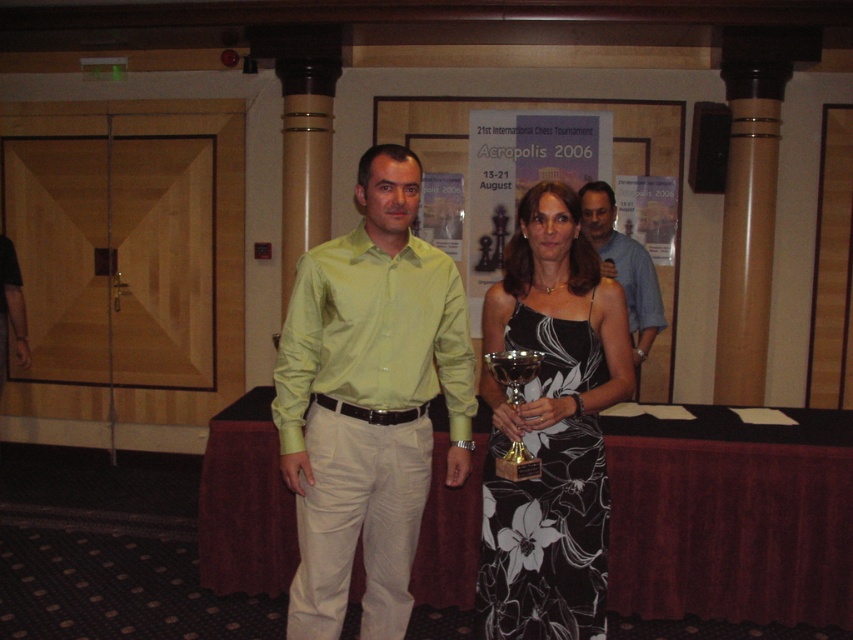
Question: Does matte green shirt at center come in front of blue cotton shirt at center?

Choices:
 (A) no
 (B) yes

Answer: (B)

Question: Estimate the real-world distances between objects in this image. Which object is farther from the blue cotton shirt at center?

Choices:
 (A) matte green shirt at center
 (B) matte blue shirt at center

Answer: (A)

Question: Which of the following is the farthest from the observer?

Choices:
 (A) blue cotton shirt at center
 (B) matte green shirt at center
 (C) matte blue shirt at center
 (D) shiny silver trophy at center

Answer: (A)

Question: In this image, where is matte green shirt at center located relative to blue cotton shirt at center?

Choices:
 (A) right
 (B) left

Answer: (B)

Question: Is matte blue shirt at center positioned before shiny silver trophy at center?

Choices:
 (A) yes
 (B) no

Answer: (B)

Question: Which point is closer to the camera taking this photo?

Choices:
 (A) (537, 332)
 (B) (648, 310)
 (C) (431, 285)
 (D) (335, 353)

Answer: (D)